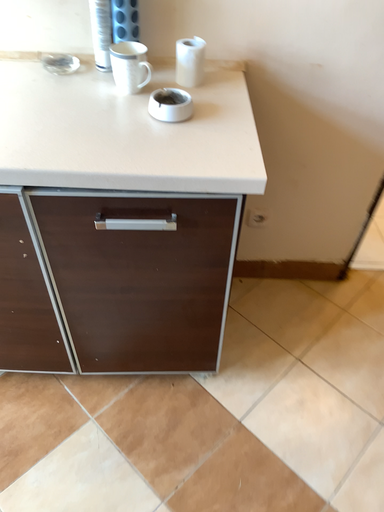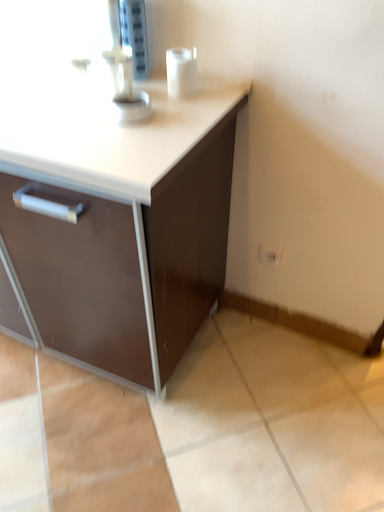
Question: Which way did the camera rotate in the video?

Choices:
 (A) rotated upward
 (B) rotated downward

Answer: (A)